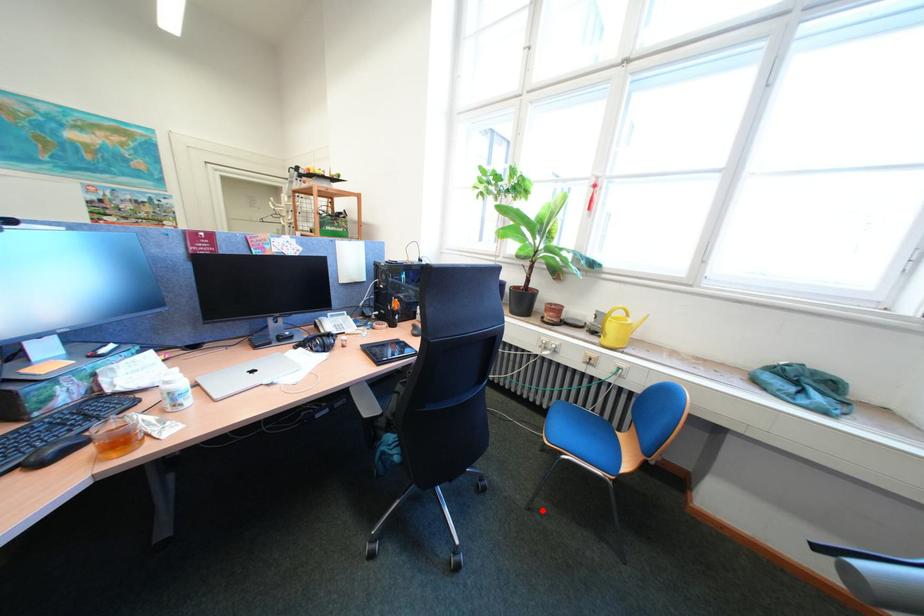
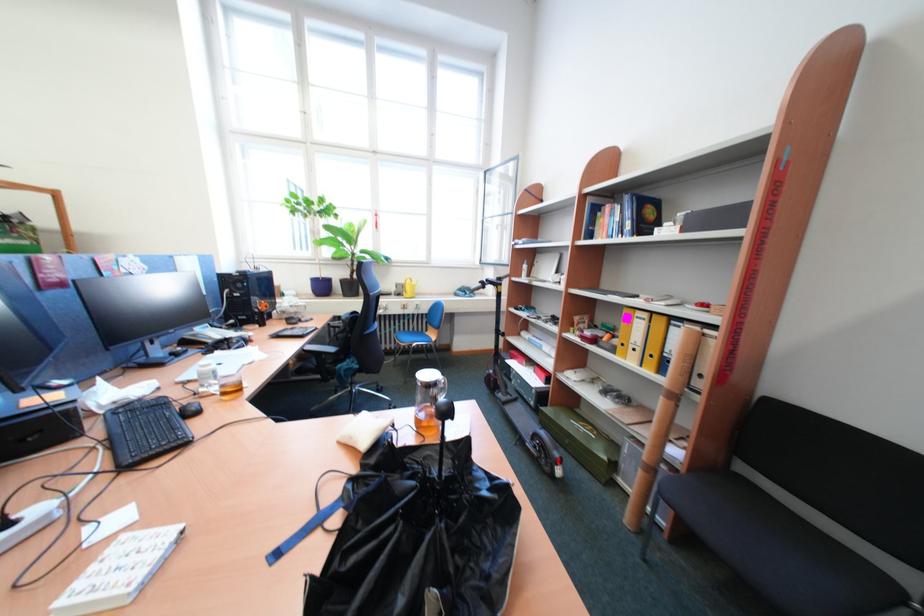
Find the pixel in the second image that matches the highlighted location in the first image.

(419, 385)